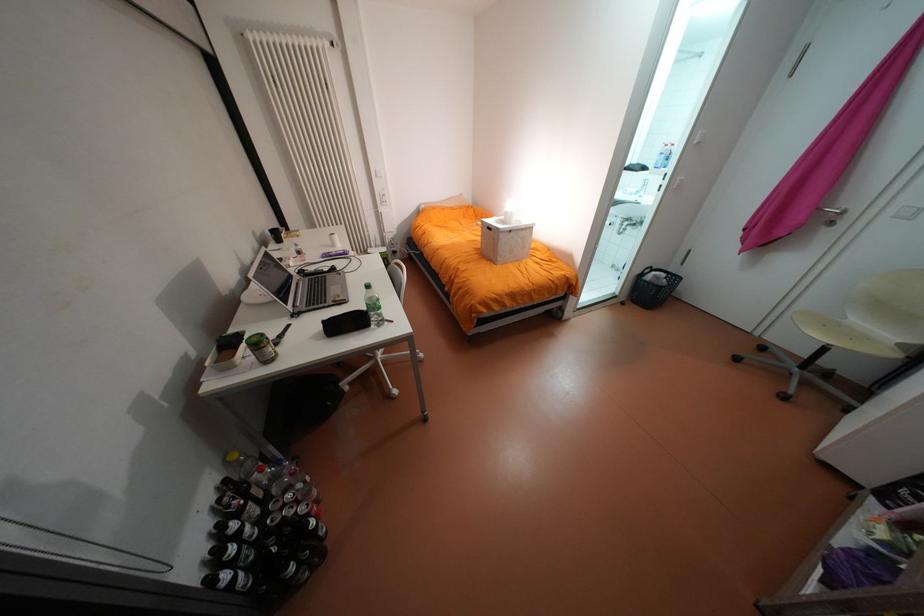
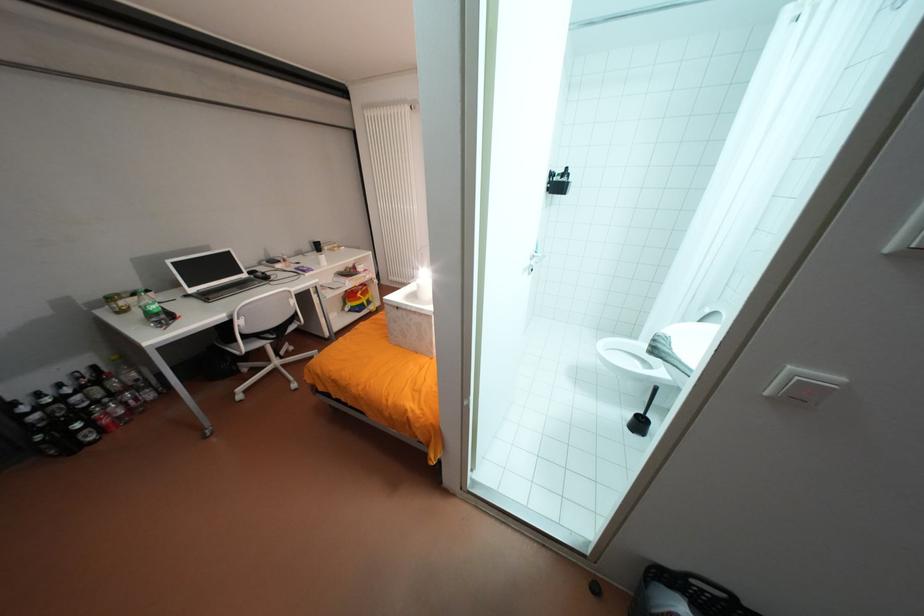
Where in the second image is the point corresponding to pixel 663 273 from the first image?

(694, 609)